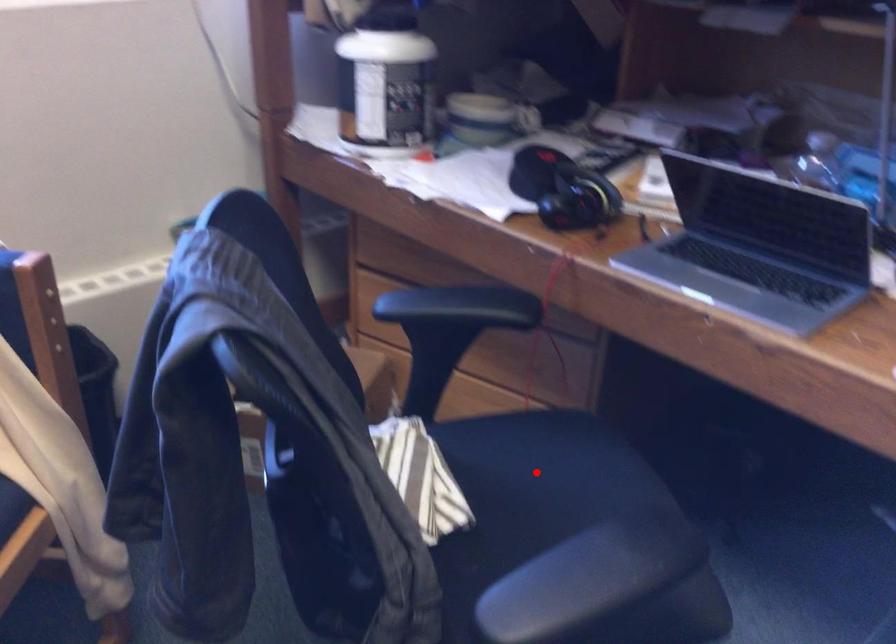
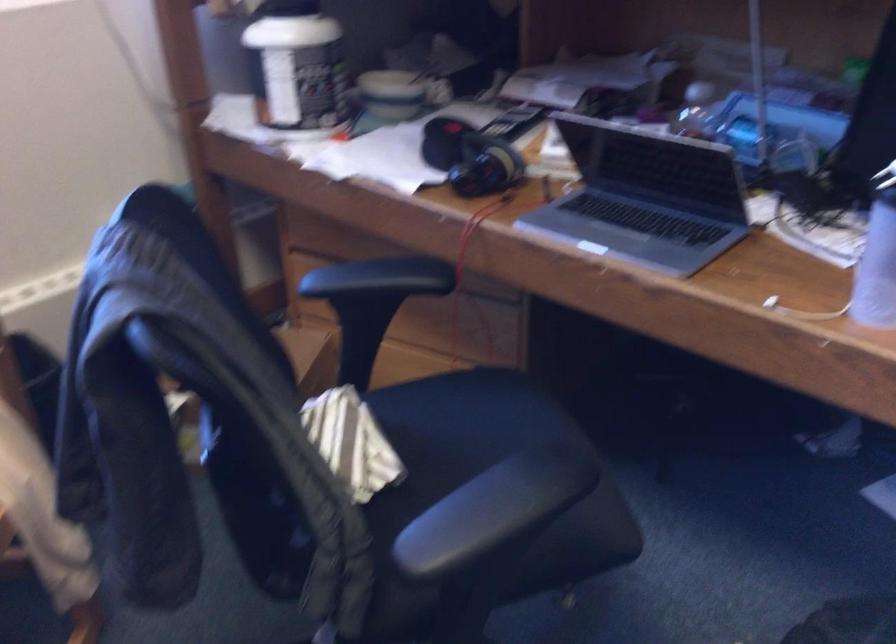
In the second image, find the point that corresponds to the highlighted location in the first image.

(461, 424)